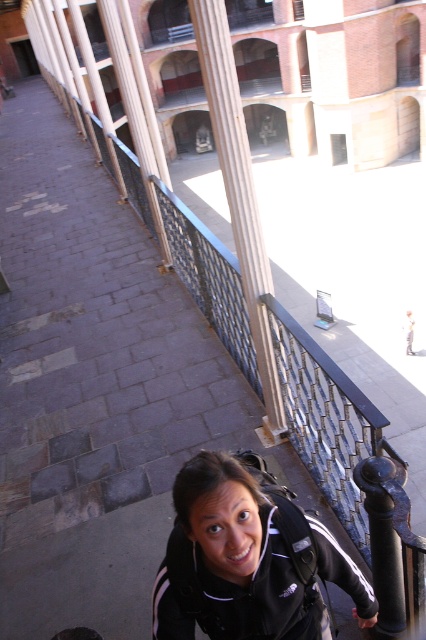
Question: Among these objects, which one is nearest to the camera?

Choices:
 (A) black fabric backpack at lower center
 (B) white polished stone column at center

Answer: (A)

Question: Can you confirm if black fabric backpack at lower center is bigger than white polished stone column at center?

Choices:
 (A) yes
 (B) no

Answer: (B)

Question: Is black fabric backpack at lower center smaller than white polished stone column at center?

Choices:
 (A) no
 (B) yes

Answer: (B)

Question: Does black fabric backpack at lower center have a larger size compared to white polished stone column at center?

Choices:
 (A) no
 (B) yes

Answer: (A)